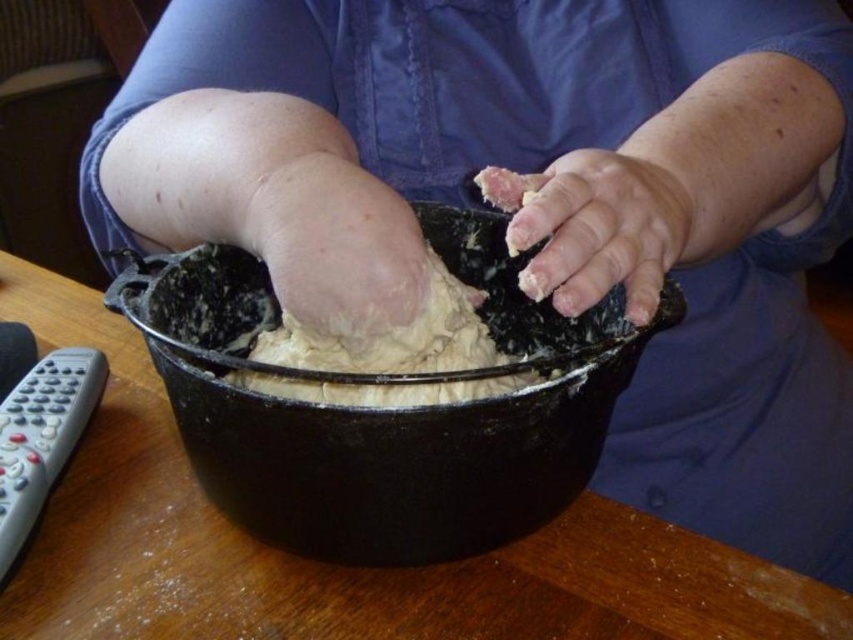
Question: Is pale skin at center to the right of white dough at center from the viewer's perspective?

Choices:
 (A) no
 (B) yes

Answer: (A)

Question: Which point is farther to the camera?

Choices:
 (A) white dough at center
 (B) dry dough at center
 (C) black matte bowl at center
 (D) pale skin at center

Answer: (B)

Question: Which object appears farthest from the camera in this image?

Choices:
 (A) black matte bowl at center
 (B) dry dough at center

Answer: (B)

Question: Which point appears farthest from the camera in this image?

Choices:
 (A) (238, 429)
 (B) (680, 228)
 (C) (268, 262)
 (D) (370, 403)

Answer: (B)

Question: Does pale skin at center have a greater width compared to white dough at center?

Choices:
 (A) no
 (B) yes

Answer: (A)

Question: Is dry dough at center below white dough at center?

Choices:
 (A) yes
 (B) no

Answer: (B)